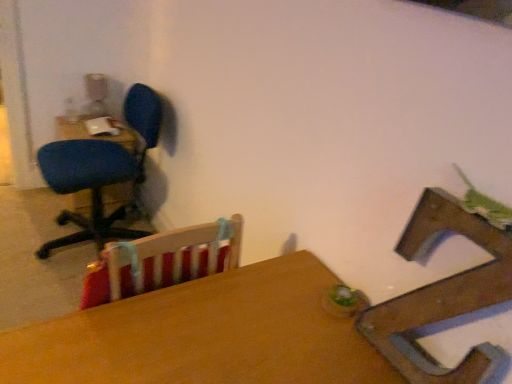
Locate an element on the screen. The image size is (512, 384). matte blue chair at left, positioned as the second table in front-to-back order is located at coordinates (99, 136).

Image resolution: width=512 pixels, height=384 pixels. Identify the location of wooden chair at center, which is the second chair in left-to-right order. (442, 295).

This screenshot has height=384, width=512. Find the location of `wooden table at center, which is the 2th table from top to bottom`. wooden table at center, which is the 2th table from top to bottom is located at coordinates (204, 335).

From a real-world perspective, is wooden table at center, the 1th table viewed from the front, above or below blue fabric office chair at left, the 1th chair when ordered from back to front?

wooden table at center, the 1th table viewed from the front, is situated lower than blue fabric office chair at left, the 1th chair when ordered from back to front, in the real world.

Which is in front, wooden table at center, the 1th table viewed from the front, or blue fabric office chair at left, the 1th chair when ordered from back to front?

Positioned in front is wooden table at center, the 1th table viewed from the front.

What are the coordinates of `table that is the 1st one below the blue fabric office chair at left, which is the 2th chair from front to back (from a real-world perspective)` in the screenshot? It's located at (204, 335).

Measure the distance from matte blue chair at left, the 1th table when ordered from top to bottom, to wooden chair at center, which is the second chair in left-to-right order.

matte blue chair at left, the 1th table when ordered from top to bottom, and wooden chair at center, which is the second chair in left-to-right order, are 1.71 meters apart.

Is matte blue chair at left, the 1th table viewed from the back, directly adjacent to wooden chair at center, which is the second chair in left-to-right order?

matte blue chair at left, the 1th table viewed from the back, and wooden chair at center, which is the second chair in left-to-right order, are not in contact.

In terms of height, does matte blue chair at left, positioned as the second table in front-to-back order, look taller or shorter compared to wooden chair at center, which appears as the 1th chair when viewed from the front?

matte blue chair at left, positioned as the second table in front-to-back order, is taller than wooden chair at center, which appears as the 1th chair when viewed from the front.

Considering the sizes of matte blue chair at left, marked as the second table in a right-to-left arrangement, and wooden chair at center, which appears as the 1th chair when viewed from the front, in the image, is matte blue chair at left, marked as the second table in a right-to-left arrangement, wider or thinner than wooden chair at center, which appears as the 1th chair when viewed from the front,?

matte blue chair at left, marked as the second table in a right-to-left arrangement, is wider than wooden chair at center, which appears as the 1th chair when viewed from the front.

From a real-world perspective, does matte blue chair at left, marked as the second table in a bottom-to-top arrangement, sit lower than blue fabric office chair at left, the 1th chair when ordered from back to front?

Yes, from a real-world perspective, matte blue chair at left, marked as the second table in a bottom-to-top arrangement, is beneath blue fabric office chair at left, the 1th chair when ordered from back to front.

From the image's perspective, is matte blue chair at left, the 1th table when ordered from left to right, located above or below blue fabric office chair at left, the 2th chair viewed from the right?

matte blue chair at left, the 1th table when ordered from left to right, is above blue fabric office chair at left, the 2th chair viewed from the right.

Considering the sizes of matte blue chair at left, the 1th table viewed from the back, and blue fabric office chair at left, arranged as the first chair when viewed from the left, in the image, is matte blue chair at left, the 1th table viewed from the back, wider or thinner than blue fabric office chair at left, arranged as the first chair when viewed from the left,?

matte blue chair at left, the 1th table viewed from the back, is thinner than blue fabric office chair at left, arranged as the first chair when viewed from the left.

The image size is (512, 384). Find the location of `table that appears below the wooden chair at center, which appears as the 1th chair when viewed from the front (from the image's perspective)`. table that appears below the wooden chair at center, which appears as the 1th chair when viewed from the front (from the image's perspective) is located at coordinates (204, 335).

Is wooden table at center, the first table when ordered from right to left, wider than wooden chair at center, the second chair viewed from the back?

Yes.

Considering the relative positions of wooden table at center, which is the second table from back to front, and wooden chair at center, the second chair viewed from the back, in the image provided, is wooden table at center, which is the second table from back to front, to the left or to the right of wooden chair at center, the second chair viewed from the back,?

wooden table at center, which is the second table from back to front, is to the left of wooden chair at center, the second chair viewed from the back.

Would you say wooden table at center, marked as the 1th table in a bottom-to-top arrangement, is inside or outside wooden chair at center, positioned as the 1th chair in right-to-left order?

wooden table at center, marked as the 1th table in a bottom-to-top arrangement, is outside wooden chair at center, positioned as the 1th chair in right-to-left order.

In terms of width, does wooden chair at center, which appears as the 1th chair when viewed from the front, look wider or thinner when compared to wooden table at center, which ranks as the 2th table in left-to-right order?

In the image, wooden chair at center, which appears as the 1th chair when viewed from the front, appears to be more narrow than wooden table at center, which ranks as the 2th table in left-to-right order.

From a real-world perspective, who is located lower, wooden chair at center, positioned as the 1th chair in right-to-left order, or wooden table at center, which ranks as the 2th table in left-to-right order?

From a 3D spatial view, wooden table at center, which ranks as the 2th table in left-to-right order, is below.

Does point (476, 363) come closer to viewer compared to point (285, 259)?

Yes, it is.

Which of these two, wooden chair at center, the second chair viewed from the back, or wooden table at center, marked as the 1th table in a bottom-to-top arrangement, is bigger?

With larger size is wooden table at center, marked as the 1th table in a bottom-to-top arrangement.

Is the position of wooden table at center, which is the second table from back to front, more distant than that of matte blue chair at left, marked as the second table in a bottom-to-top arrangement?

No, wooden table at center, which is the second table from back to front, is closer to the camera.

Is matte blue chair at left, the 1th table when ordered from left to right, a part of wooden table at center, the first table when ordered from right to left?

No, matte blue chair at left, the 1th table when ordered from left to right, is not a part of wooden table at center, the first table when ordered from right to left.

Consider the image. How different are the orientations of wooden table at center, which ranks as the 2th table in left-to-right order, and matte blue chair at left, the 1th table when ordered from left to right, in degrees?

wooden table at center, which ranks as the 2th table in left-to-right order, and matte blue chair at left, the 1th table when ordered from left to right, are facing 88.7 degrees away from each other.

Which object is positioned more to the left, wooden table at center, which ranks as the 2th table in left-to-right order, or matte blue chair at left, the 1th table when ordered from top to bottom?

matte blue chair at left, the 1th table when ordered from top to bottom.

Which object is closer to the camera taking this photo, blue fabric office chair at left, the 2th chair viewed from the right, or matte blue chair at left, the 1th table when ordered from top to bottom?

blue fabric office chair at left, the 2th chair viewed from the right.

Which of these two, blue fabric office chair at left, which is the 2th chair from front to back, or matte blue chair at left, the 1th table when ordered from left to right, is bigger?

blue fabric office chair at left, which is the 2th chair from front to back, is bigger.

From the image's perspective, starting from the matte blue chair at left, marked as the second table in a right-to-left arrangement, which chair is the 1st one below? Please provide its 2D coordinates.

[(101, 172)]

Identify the location of the 1st chair positioned above the wooden table at center, which is the second table from back to front (from a real-world perspective). (101, 172).

Where is `table that appears above the wooden chair at center, which appears as the 1th chair when viewed from the front (from the image's perspective)`? table that appears above the wooden chair at center, which appears as the 1th chair when viewed from the front (from the image's perspective) is located at coordinates (99, 136).

Considering their positions, is wooden chair at center, which appears as the 1th chair when viewed from the front, positioned closer to blue fabric office chair at left, which is the 2th chair from front to back, than matte blue chair at left, positioned as the second table in front-to-back order?

matte blue chair at left, positioned as the second table in front-to-back order, is closer to blue fabric office chair at left, which is the 2th chair from front to back.

Which object lies nearer to the anchor point matte blue chair at left, the 1th table viewed from the back, wooden table at center, the first table when ordered from right to left, or wooden chair at center, which appears as the 1th chair when viewed from the front?

Among the two, wooden table at center, the first table when ordered from right to left, is located nearer to matte blue chair at left, the 1th table viewed from the back.

Estimate the real-world distances between objects in this image. Which object is further from wooden chair at center, which is the second chair in left-to-right order, wooden table at center, the first table when ordered from right to left, or blue fabric office chair at left, the 2th chair viewed from the right?

The object further to wooden chair at center, which is the second chair in left-to-right order, is blue fabric office chair at left, the 2th chair viewed from the right.

Which object lies nearer to the anchor point blue fabric office chair at left, which is the 2th chair from front to back, wooden table at center, the first table when ordered from right to left, or wooden chair at center, the second chair viewed from the back?

Based on the image, wooden table at center, the first table when ordered from right to left, appears to be nearer to blue fabric office chair at left, which is the 2th chair from front to back.

Considering their positions, is matte blue chair at left, the 1th table viewed from the back, positioned closer to wooden table at center, marked as the 1th table in a bottom-to-top arrangement, than wooden chair at center, the second chair viewed from the back?

wooden chair at center, the second chair viewed from the back.

When comparing their distances from blue fabric office chair at left, the 1th chair when ordered from back to front, does matte blue chair at left, the 1th table when ordered from left to right, or wooden chair at center, which is the second chair in left-to-right order, seem further?

wooden chair at center, which is the second chair in left-to-right order, lies further to blue fabric office chair at left, the 1th chair when ordered from back to front, than the other object.

Considering their positions, is wooden chair at center, the second chair viewed from the back, positioned closer to wooden table at center, the first table when ordered from right to left, than matte blue chair at left, the 1th table viewed from the back?

The object closer to wooden table at center, the first table when ordered from right to left, is wooden chair at center, the second chair viewed from the back.

From the image, which object appears to be nearer to blue fabric office chair at left, the 2th chair viewed from the right, wooden table at center, marked as the 1th table in a bottom-to-top arrangement, or matte blue chair at left, positioned as the second table in front-to-back order?

matte blue chair at left, positioned as the second table in front-to-back order, is positioned closer to the anchor blue fabric office chair at left, the 2th chair viewed from the right.

Where is `chair between wooden chair at center, positioned as the 1th chair in right-to-left order, and matte blue chair at left, marked as the second table in a right-to-left arrangement, from front to back`? chair between wooden chair at center, positioned as the 1th chair in right-to-left order, and matte blue chair at left, marked as the second table in a right-to-left arrangement, from front to back is located at coordinates (x=101, y=172).

Image resolution: width=512 pixels, height=384 pixels. Find the location of `table located between blue fabric office chair at left, arranged as the first chair when viewed from the left, and wooden chair at center, the second chair viewed from the back, in the left-right direction`. table located between blue fabric office chair at left, arranged as the first chair when viewed from the left, and wooden chair at center, the second chair viewed from the back, in the left-right direction is located at coordinates click(204, 335).